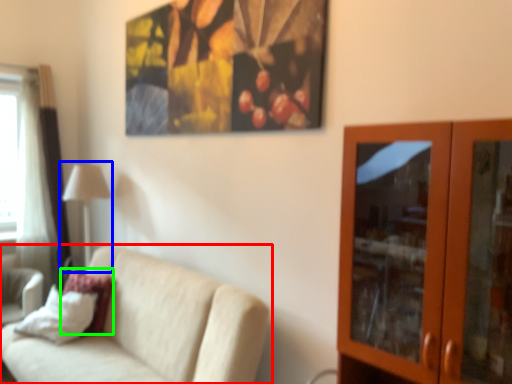
Question: Which object is positioned farthest from studio couch (highlighted by a red box)? Select from table lamp (highlighted by a blue box) and pillow (highlighted by a green box).

Choices:
 (A) table lamp
 (B) pillow

Answer: (A)